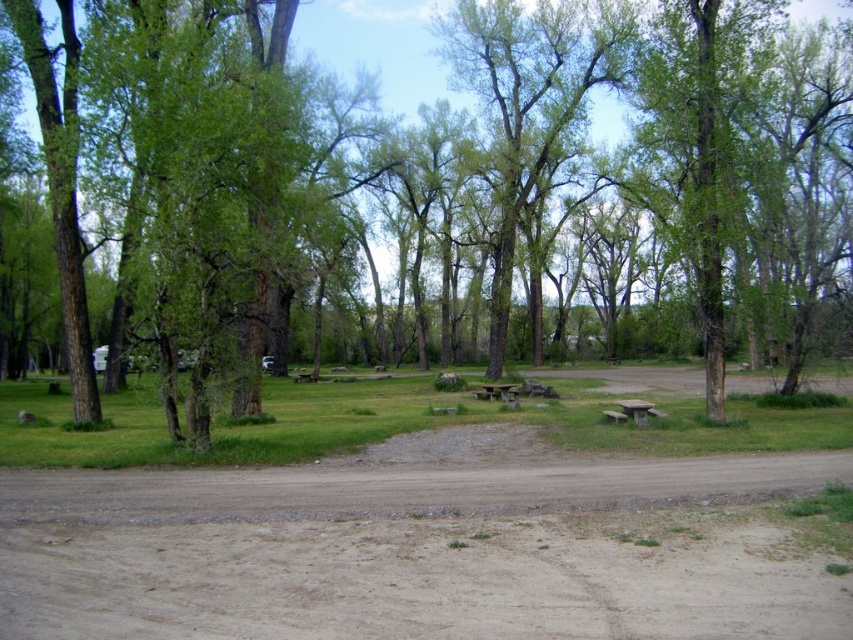
Does brown sandy dirt field at center have a greater height compared to stone textured picnic table at center?

Yes.

Who is lower down, brown sandy dirt field at center or stone textured picnic table at center?

stone textured picnic table at center

Does point (440, 440) lie in front of point (640, 408)?

Yes, it is in front of point (640, 408).

Where is `brown sandy dirt field at center`? The image size is (853, 640). brown sandy dirt field at center is located at coordinates (418, 547).

Is point (393, 76) positioned behind point (631, 403)?

Yes, point (393, 76) is behind point (631, 403).

Describe the element at coordinates (378, 44) in the screenshot. I see `green leafy tree at center` at that location.

This screenshot has height=640, width=853. What are the coordinates of `green leafy tree at center` in the screenshot? It's located at (378, 44).

Can you confirm if stone textured picnic table at center is positioned to the right of wooden picnic table at center?

Yes, stone textured picnic table at center is to the right of wooden picnic table at center.

Is stone textured picnic table at center closer to camera compared to wooden picnic table at center?

That is True.

Identify the location of stone textured picnic table at center. The image size is (853, 640). (636, 410).